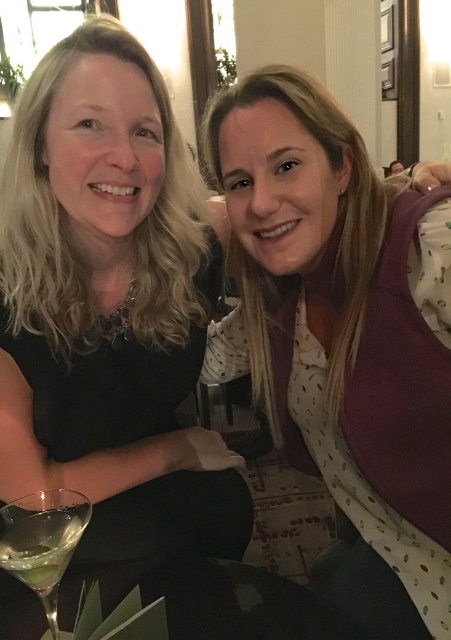
Question: Which point is farther to the camera?

Choices:
 (A) clear glass martini at lower left
 (B) white dotted shirt at center

Answer: (B)

Question: Does matte black dress at center appear on the left side of white dotted shirt at center?

Choices:
 (A) no
 (B) yes

Answer: (B)

Question: Does matte black dress at center have a larger size compared to white dotted shirt at center?

Choices:
 (A) no
 (B) yes

Answer: (B)

Question: Among these objects, which one is nearest to the camera?

Choices:
 (A) white dotted shirt at center
 (B) matte black dress at center

Answer: (A)

Question: Which of the following is the farthest from the observer?

Choices:
 (A) (327, 285)
 (B) (30, 515)
 (C) (116, 492)

Answer: (C)

Question: Does white dotted shirt at center appear on the right side of clear glass martini at lower left?

Choices:
 (A) yes
 (B) no

Answer: (A)